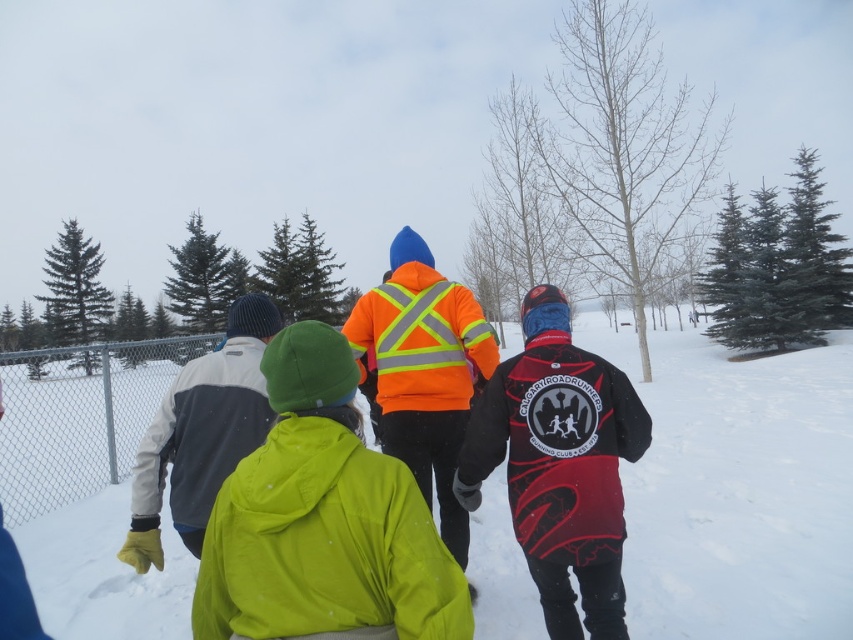
Based on the photo, is neon green jacket at center further to camera compared to high-visibility orange jacket at center?

That is False.

Can you confirm if neon green jacket at center is positioned below high-visibility orange jacket at center?

No.

This screenshot has height=640, width=853. What do you see at coordinates (323, 522) in the screenshot? I see `neon green jacket at center` at bounding box center [323, 522].

This screenshot has height=640, width=853. In order to click on neon green jacket at center in this screenshot , I will do pyautogui.click(x=323, y=522).

Is white fluffy snow at center positioned at the back of silver chain-link fence at left?

No, white fluffy snow at center is in front of silver chain-link fence at left.

Who is higher up, white fluffy snow at center or silver chain-link fence at left?

white fluffy snow at center is above.

Locate an element on the screen. The height and width of the screenshot is (640, 853). white fluffy snow at center is located at coordinates (737, 488).

Find the location of a particular element. Image resolution: width=853 pixels, height=640 pixels. white fluffy snow at center is located at coordinates (737, 488).

Locate an element on the screen. The width and height of the screenshot is (853, 640). white fluffy snow at center is located at coordinates (737, 488).

Does white fluffy snow at center come behind red matte jacket at center?

Yes.

At what (x,y) coordinates should I click in order to perform the action: click on white fluffy snow at center. Please return your answer as a coordinate pair (x, y). Image resolution: width=853 pixels, height=640 pixels. Looking at the image, I should click on (737, 488).